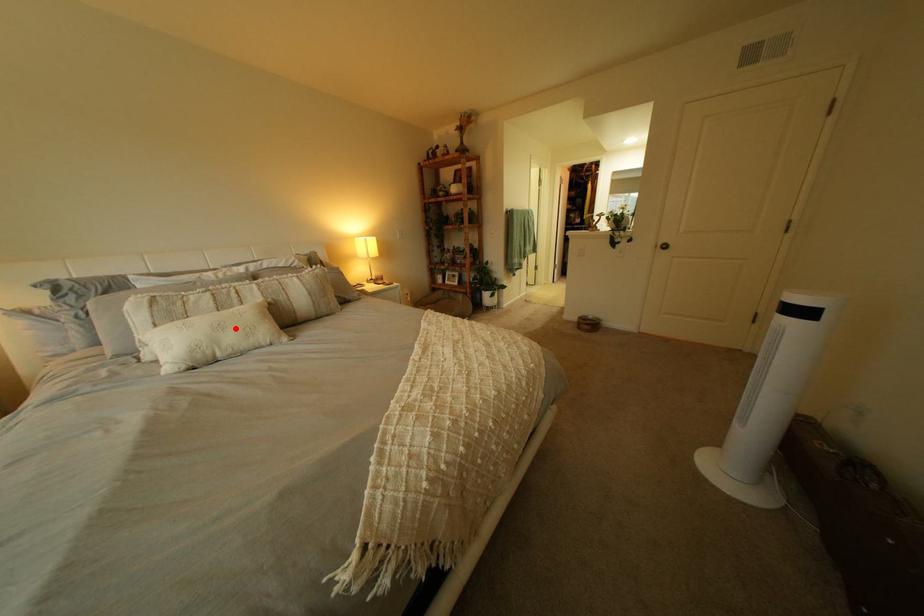
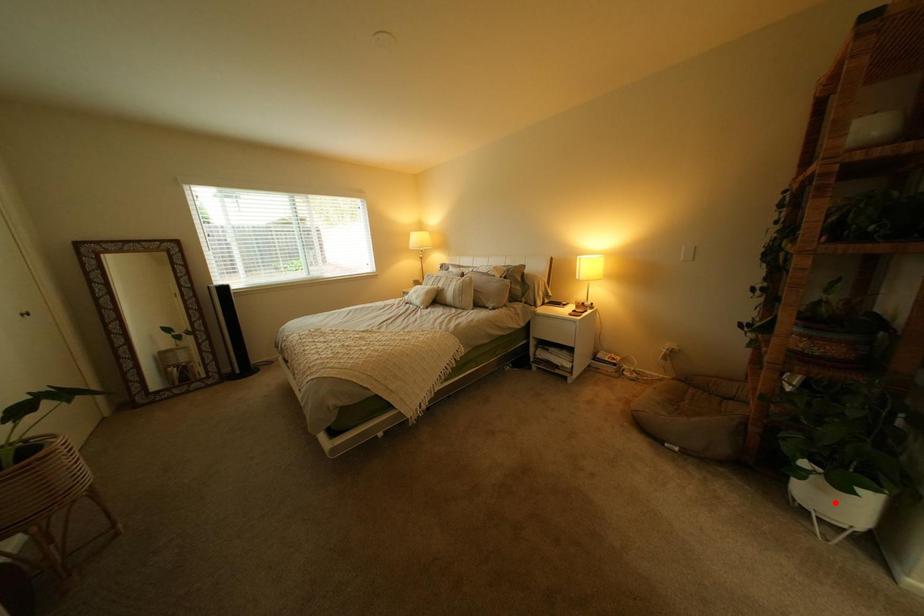
I am providing you with two images of the same scene from different viewpoints. A red point is marked on the first image and another point is marked on the second image. Are the points marked in image1 and image2 representing the same 3D position?

No